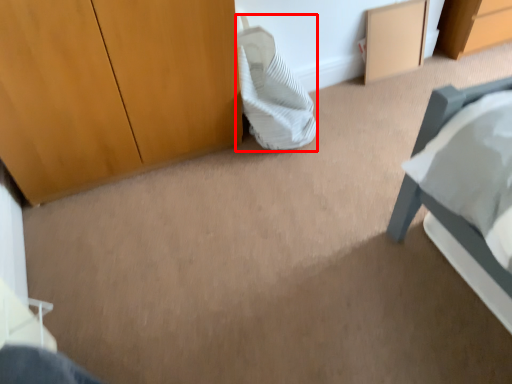
Question: From the image's perspective, considering the relative positions of pillow (annotated by the red box) and cabinetry in the image provided, where is pillow (annotated by the red box) located with respect to the staircase?

Choices:
 (A) above
 (B) below

Answer: (B)